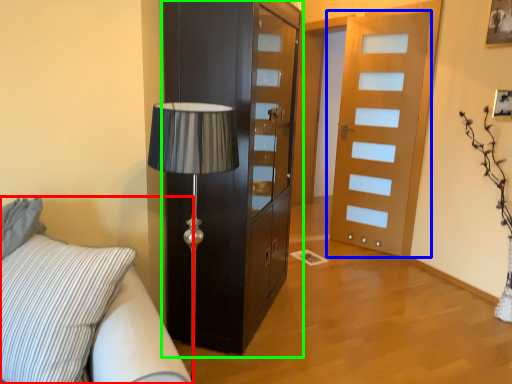
Question: Estimate the real-world distances between objects in this image. Which object is closer to studio couch (highlighted by a red box), door (highlighted by a blue box) or cabinetry (highlighted by a green box)?

Choices:
 (A) door
 (B) cabinetry

Answer: (B)